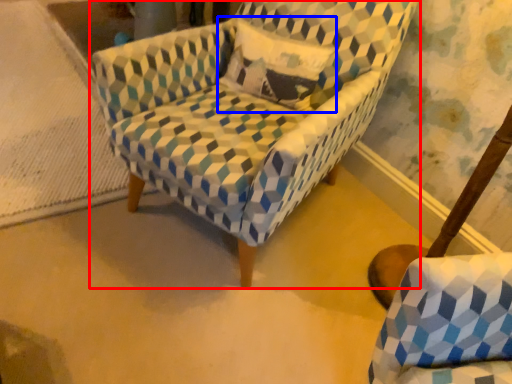
Question: Which of the following is the closest to the observer, chair (highlighted by a red box) or throw pillow (highlighted by a blue box)?

Choices:
 (A) chair
 (B) throw pillow

Answer: (A)